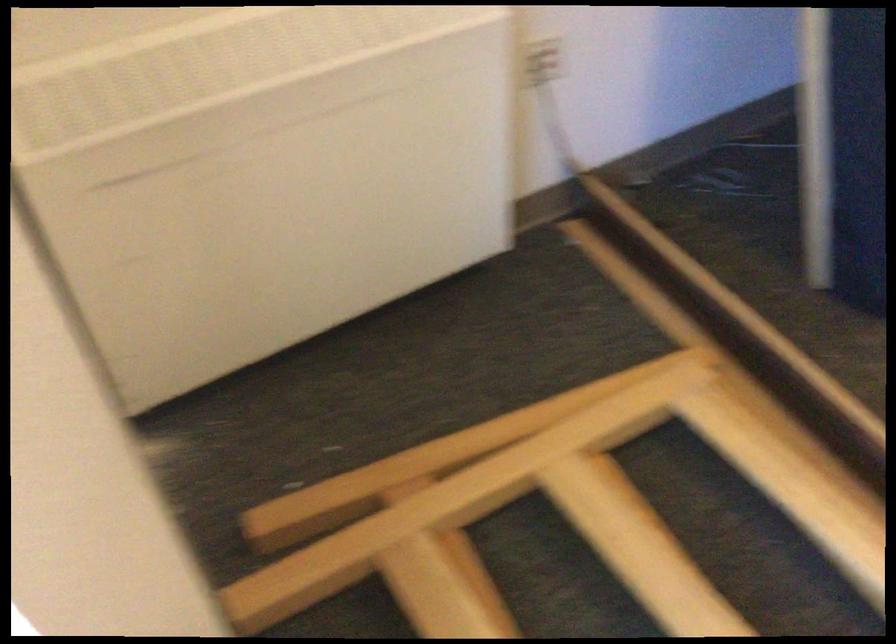
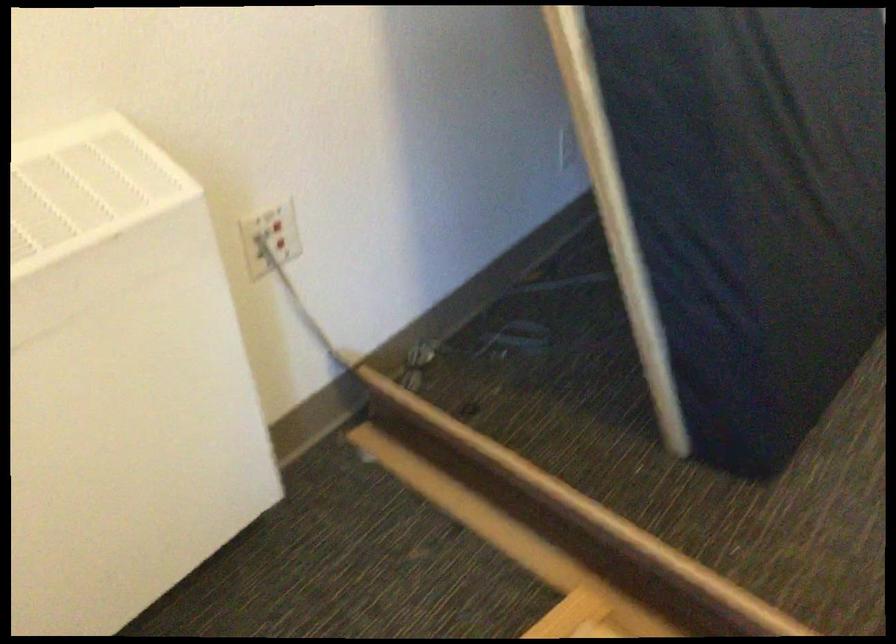
The point at (x=630, y=184) is marked in the first image. Where is the corresponding point in the second image?

(418, 363)